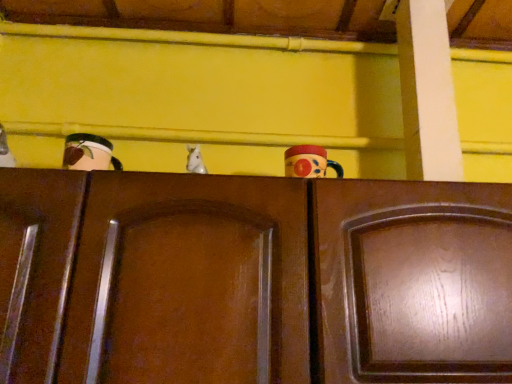
Question: Is point (200, 157) closer or farther from the camera than point (318, 175)?

Choices:
 (A) closer
 (B) farther

Answer: (B)

Question: Looking at the image, does white glossy horse at center, placed as the 1th toy when sorted from left to right, seem bigger or smaller compared to glossy ceramic mug at upper center, which ranks as the second toy in left-to-right order?

Choices:
 (A) big
 (B) small

Answer: (B)

Question: Based on their relative distances, which object is nearer to the glossy wood door at center, which is the 2th door from right to left?

Choices:
 (A) wooden cabinet at center, the 2th door from the left
 (B) white glossy horse at center, placed as the 1th toy when sorted from left to right
 (C) glossy ceramic mug at upper center, the first toy when ordered from right to left

Answer: (A)

Question: Estimate the real-world distances between objects in this image. Which object is farther from the glossy wood door at center, which is the 2th door from right to left?

Choices:
 (A) white glossy horse at center, placed as the 1th toy when sorted from left to right
 (B) glossy ceramic mug at upper center, which ranks as the second toy in left-to-right order
 (C) wooden cabinet at center, placed as the first door when sorted from right to left

Answer: (B)